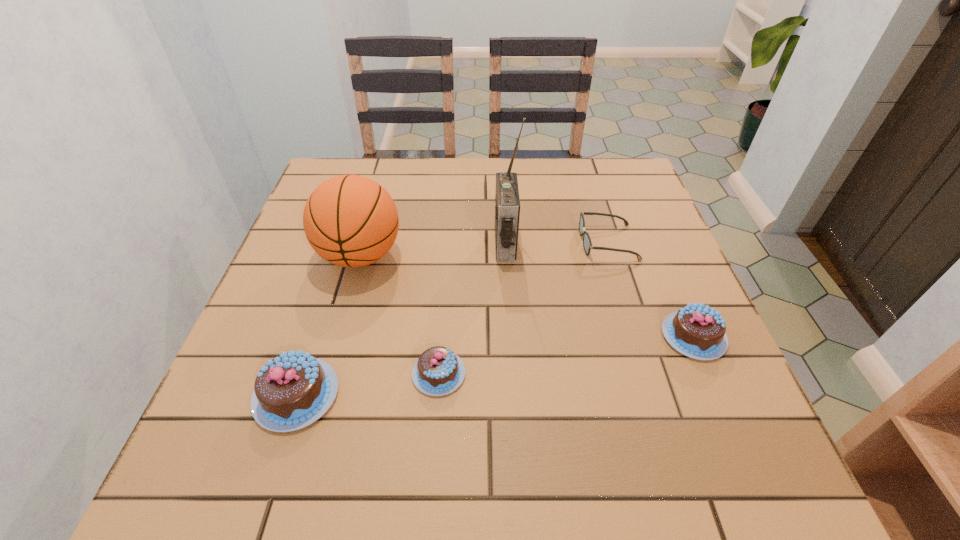
Locate an element on the screen. This screenshot has height=540, width=960. the leftmost chocolate cake is located at coordinates (293, 390).

Locate an element on the screen. Image resolution: width=960 pixels, height=540 pixels. the third tallest object is located at coordinates (293, 390).

Locate an element on the screen. The height and width of the screenshot is (540, 960). the shortest chocolate cake is located at coordinates (438, 371).

Where is `the fourth object from right to left`? Image resolution: width=960 pixels, height=540 pixels. the fourth object from right to left is located at coordinates (438, 371).

Locate an element on the screen. the fourth tallest object is located at coordinates (697, 331).

Where is `the rightmost chocolate cake`? the rightmost chocolate cake is located at coordinates (697, 331).

Find the location of `basketball`. basketball is located at coordinates (349, 220).

The image size is (960, 540). Identify the location of the tallest object. (507, 202).

Where is `radio receiver`? radio receiver is located at coordinates (507, 202).

Where is `spectacles`? The width and height of the screenshot is (960, 540). spectacles is located at coordinates (587, 244).